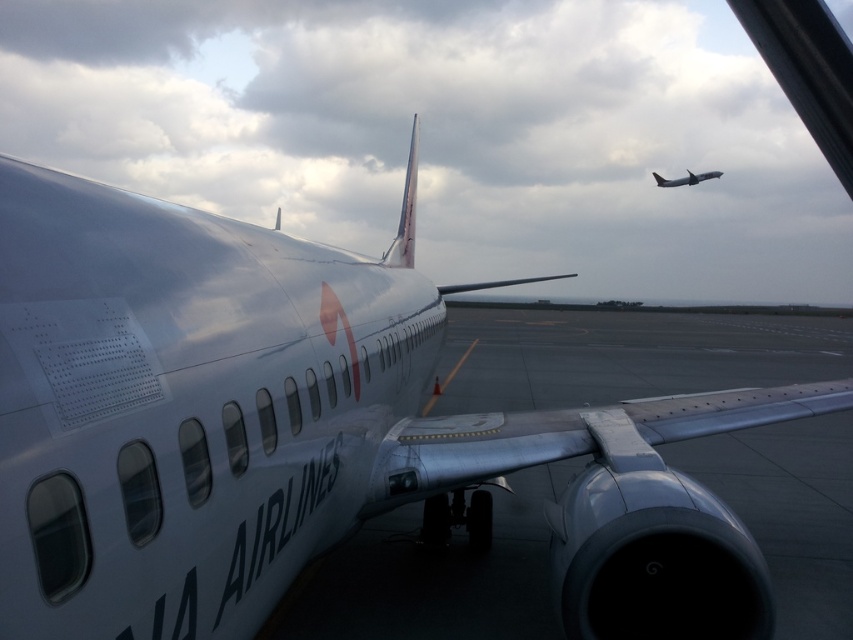
Who is more distant from viewer, (572, 420) or (666, 182)?

The point (666, 182) is behind.

Is metallic silver wing at center further to the viewer compared to silver metallic airplane at upper right?

No, metallic silver wing at center is closer to the viewer.

Which is in front, point (752, 417) or point (688, 177)?

Positioned in front is point (752, 417).

This screenshot has width=853, height=640. In order to click on metallic silver wing at center in this screenshot , I will do `click(576, 435)`.